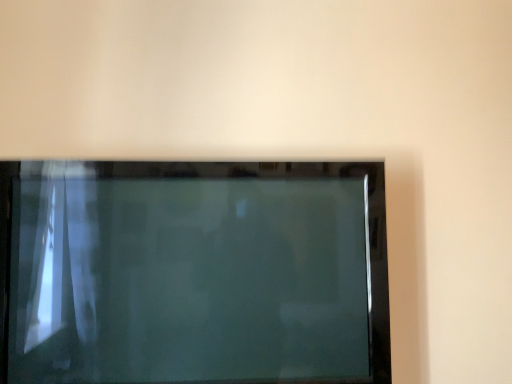
This screenshot has height=384, width=512. I want to click on matte black tv at center, so click(x=193, y=273).

What do you see at coordinates (193, 273) in the screenshot? The image size is (512, 384). I see `matte black tv at center` at bounding box center [193, 273].

Measure the distance between matte black tv at center and camera.

They are 3.57 feet apart.

The width and height of the screenshot is (512, 384). I want to click on matte black tv at center, so click(x=193, y=273).